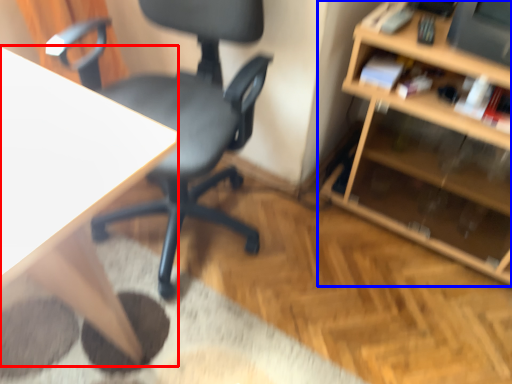
Question: Among these objects, which one is nearest to the camera, desk (highlighted by a red box) or shelf (highlighted by a blue box)?

Choices:
 (A) desk
 (B) shelf

Answer: (A)